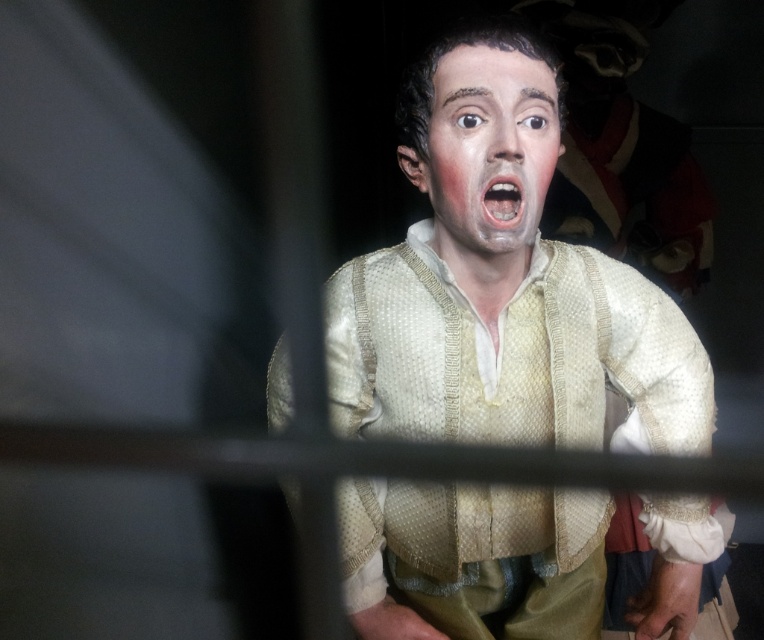
You are an actor preparing for a play and need to position your costume and makeup correctly. Given the scene described, where should the matte cream vest at center be placed in relation to the matte white face at center?

The matte cream vest at center should be placed below the matte white face at center as per the description.

You are an artist trying to paint the scene. You need to place the matte cream vest at center in your canvas. What coordinates should you use for its position?

The matte cream vest at center is located at coordinates point [502,285].